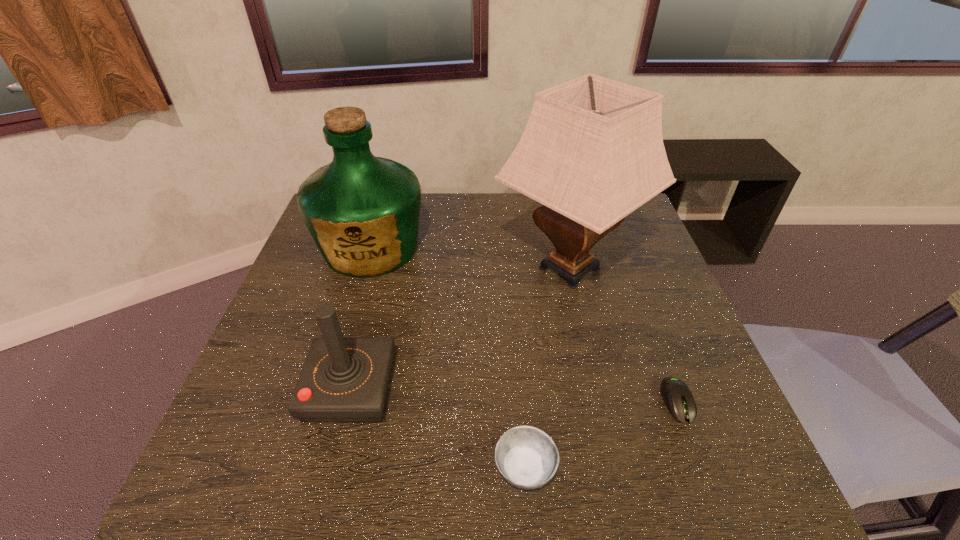
You are a GUI agent. You are given a task and a screenshot of the screen. Output one action in this format:
    pyautogui.click(x=<x>, y=<y>)
    Task: Click on the free location located on the wheel side of the shortest object
    The height and width of the screenshot is (540, 960).
    Given the screenshot: What is the action you would take?
    pyautogui.click(x=702, y=465)

Image resolution: width=960 pixels, height=540 pixels. I want to click on lampshade that is at the far edge, so click(592, 152).

Where is `liquor that is positioned at the far edge`? liquor that is positioned at the far edge is located at coordinates (362, 211).

Locate an element on the screen. This screenshot has width=960, height=540. object that is at the near edge is located at coordinates (526, 457).

Identify the location of liquor at the left edge. (362, 211).

The image size is (960, 540). I want to click on joystick located at the left edge, so click(343, 379).

Locate an element on the screen. lampshade situated at the right edge is located at coordinates (592, 152).

This screenshot has width=960, height=540. Find the location of `computer mouse situated at the right edge`. computer mouse situated at the right edge is located at coordinates (676, 395).

Locate an element on the screen. The image size is (960, 540). object located at the far left corner is located at coordinates (362, 211).

The image size is (960, 540). What are the coordinates of `object present at the far right corner` in the screenshot? It's located at (592, 152).